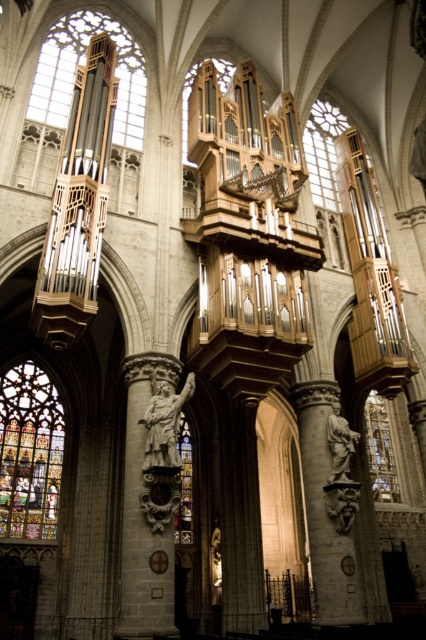
Question: Is white stone statue at center thinner than polished bronze statue at center?

Choices:
 (A) no
 (B) yes

Answer: (A)

Question: Which object is closer to the camera taking this photo?

Choices:
 (A) white stone statue at center
 (B) polished bronze statue at center

Answer: (A)

Question: Is clear glass at upper left closer to camera compared to clear glass at upper right?

Choices:
 (A) yes
 (B) no

Answer: (A)

Question: Estimate the real-world distances between objects in this image. Which object is farther from the white stone statue at center?

Choices:
 (A) stone statue at center
 (B) clear glass at upper right
 (C) polished bronze statue at center
 (D) clear glass at upper left

Answer: (B)

Question: Where is clear glass at upper right located in relation to stone statue at center in the image?

Choices:
 (A) below
 (B) above

Answer: (B)

Question: Which point appears farthest from the camera in this image?

Choices:
 (A) (17, 387)
 (B) (46, 120)
 (C) (319, 176)
 (D) (155, 422)

Answer: (C)